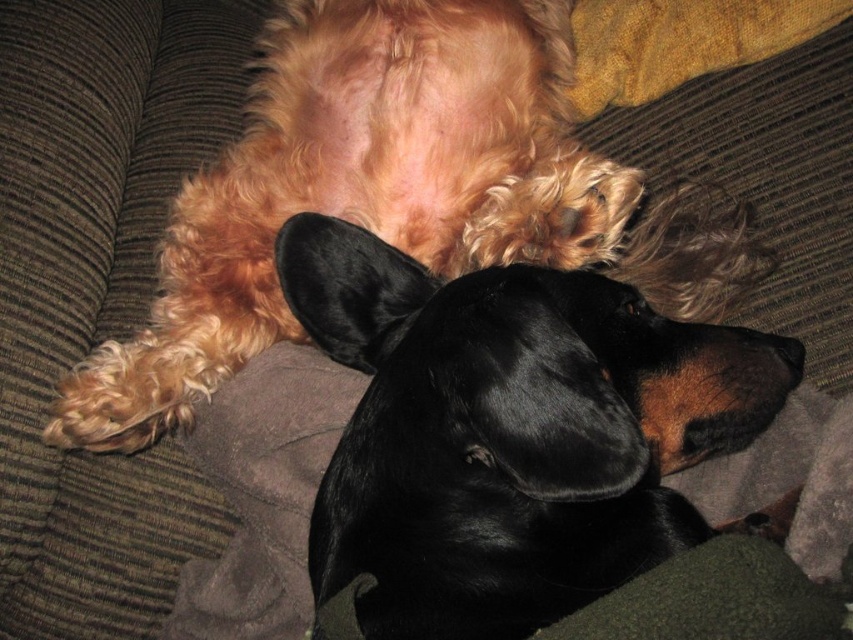
Can you confirm if black shiny dog at center is positioned to the right of fluffy golden dog at upper center?

Correct, you'll find black shiny dog at center to the right of fluffy golden dog at upper center.

What are the coordinates of `black shiny dog at center` in the screenshot? It's located at coord(509,433).

I want to click on black shiny dog at center, so click(509, 433).